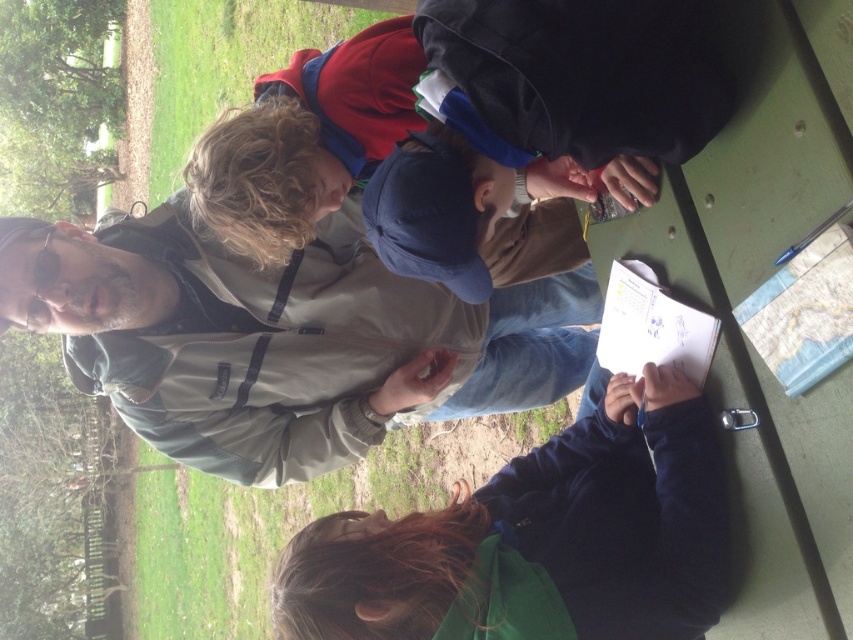
Question: Which object appears farthest from the camera in this image?

Choices:
 (A) dark brown hair at lower center
 (B) gray fabric jacket at upper left

Answer: (B)

Question: Does gray fabric jacket at upper left appear under dark brown hair at lower center?

Choices:
 (A) yes
 (B) no

Answer: (B)

Question: Where is gray fabric jacket at upper left located in relation to dark brown hair at lower center in the image?

Choices:
 (A) right
 (B) left

Answer: (B)

Question: Can you confirm if gray fabric jacket at upper left is positioned below dark brown hair at lower center?

Choices:
 (A) yes
 (B) no

Answer: (B)